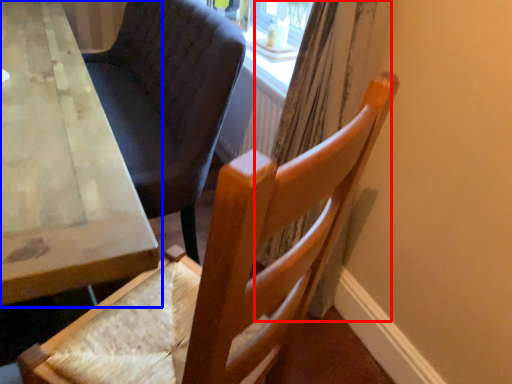
Question: Which object appears farthest to the camera in this image, curtain (highlighted by a red box) or table (highlighted by a blue box)?

Choices:
 (A) curtain
 (B) table

Answer: (A)